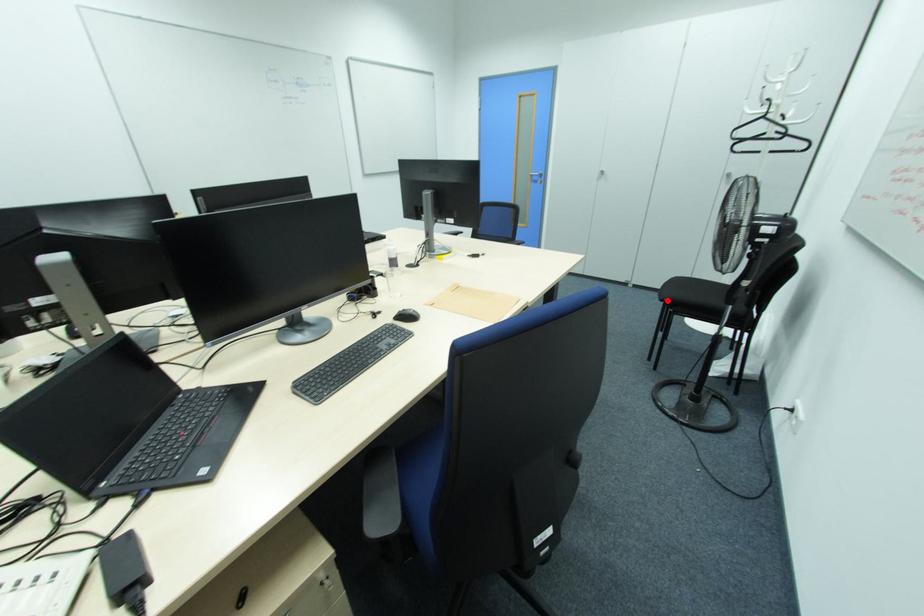
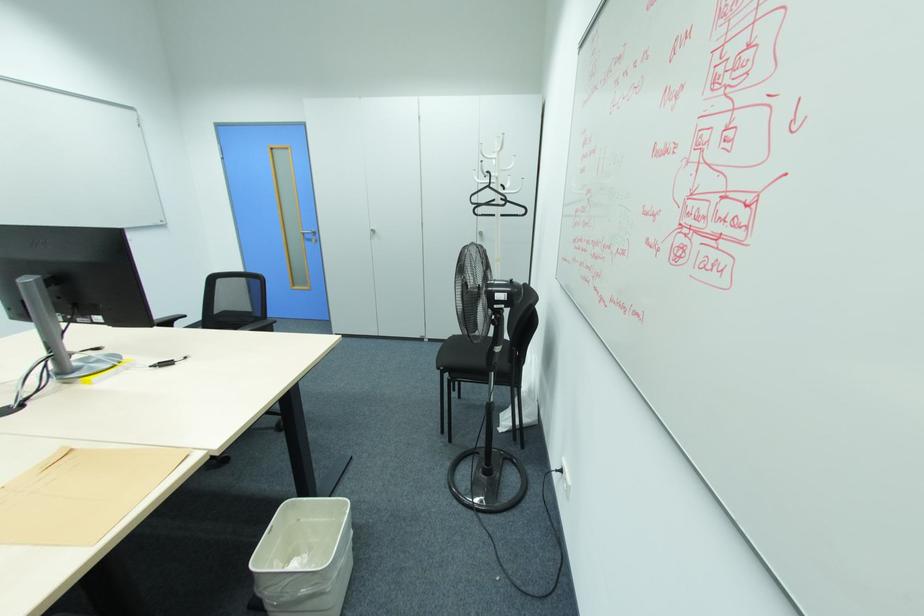
Locate, in the second image, the point that corresponds to the highlighted location in the first image.

(442, 369)